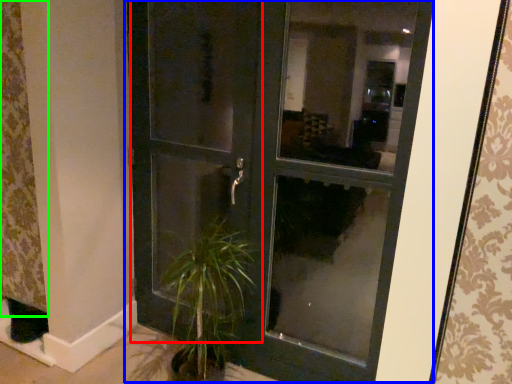
Question: Based on their relative distances, which object is farther from screen door (highlighted by a red box)? Choose from door (highlighted by a blue box) and curtain (highlighted by a green box).

Choices:
 (A) door
 (B) curtain

Answer: (B)